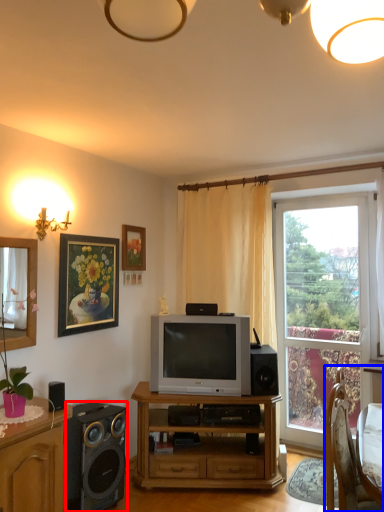
Question: Which of the following is the farthest to the observer, speaker (highlighted by a red box) or chair (highlighted by a blue box)?

Choices:
 (A) speaker
 (B) chair

Answer: (A)